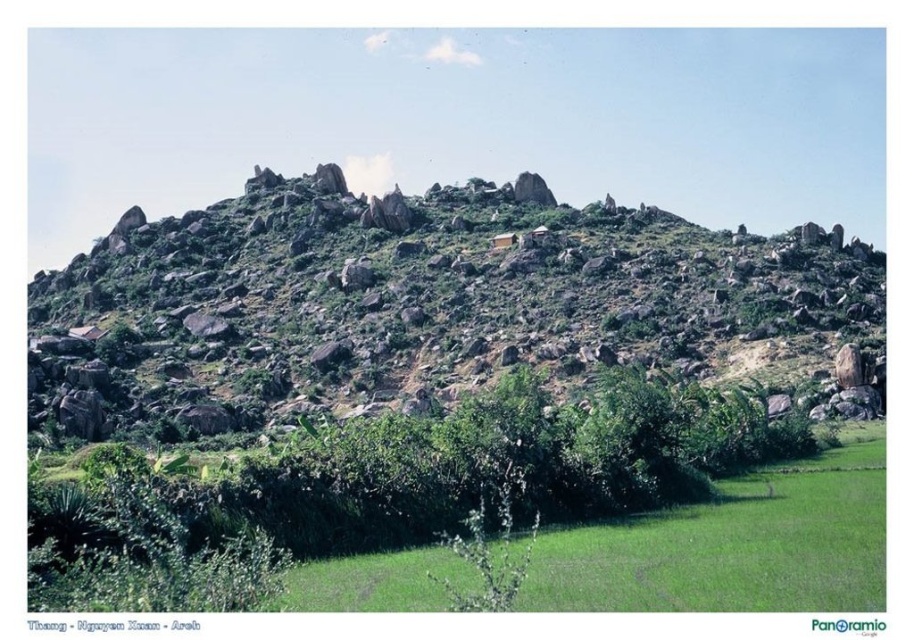
Question: Among these points, which one is farthest from the camera?

Choices:
 (A) (307, 308)
 (B) (565, 547)

Answer: (A)

Question: Can you confirm if rough stone mountain at upper center is positioned below green grassy at lower center?

Choices:
 (A) yes
 (B) no

Answer: (B)

Question: Observing the image, what is the correct spatial positioning of rough stone mountain at upper center in reference to green grassy at lower center?

Choices:
 (A) below
 (B) above

Answer: (B)

Question: Which point appears farthest from the camera in this image?

Choices:
 (A) (165, 256)
 (B) (862, 580)

Answer: (A)

Question: Does rough stone mountain at upper center come in front of green grassy at lower center?

Choices:
 (A) yes
 (B) no

Answer: (B)